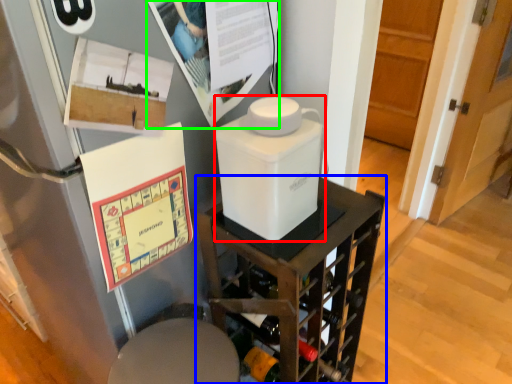
Question: Estimate the real-world distances between objects in this image. Which object is farther from appliance (highlighted by a red box), furniture (highlighted by a blue box) or poster page (highlighted by a green box)?

Choices:
 (A) furniture
 (B) poster page

Answer: (A)